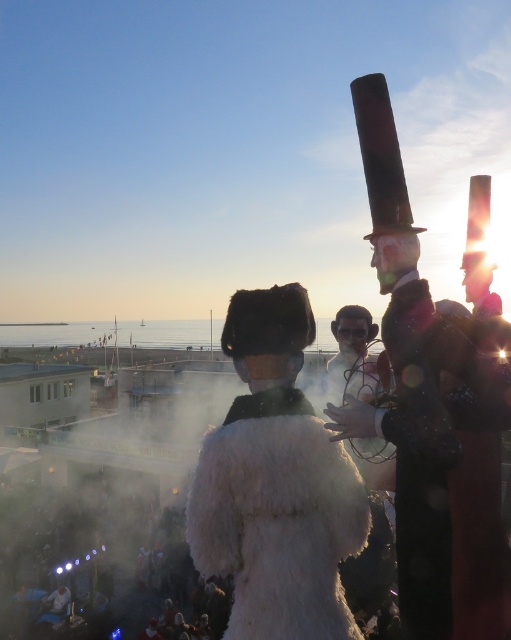
You are a photographer at the festival and want to capture both the shiny black suit at center and the white fluffy coat at center in a single photo. Which one should you focus on first to ensure it appears larger in the photo?

The shiny black suit at center is much taller than the white fluffy coat at center, so focusing on the shiny black suit at center first will ensure it appears larger in the photo.

You are a photographer trying to capture a group photo of the shiny black suit at center and the white fluffy coat at center. The camera you have can only focus on objects within a 1.5 meter width. Can both of them fit into the frame if they stand side by side?

The shiny black suit at center is wider than the white fluffy coat at center. Since the camera can only focus on objects within a 1.5 meter width, it depends on the combined width of both objects. However, the description only provides their relative widths, not exact measurements. Therefore, it is unclear if they can fit together within the 1.5 meter limit.